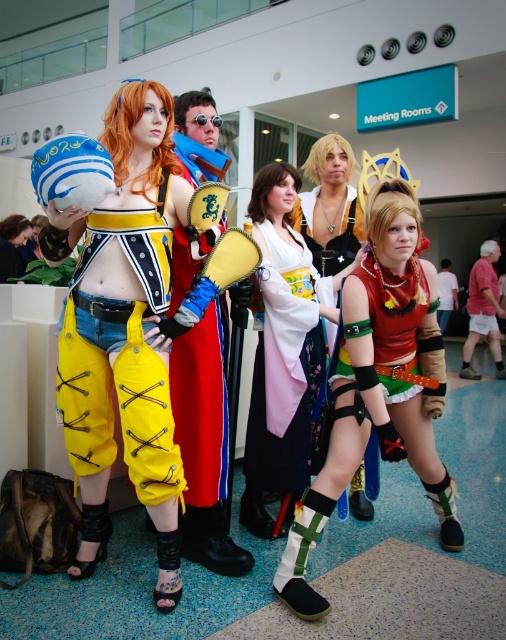
Does matte yellow pants at center appear on the left side of matte red and green boots at center?

Yes, matte yellow pants at center is to the left of matte red and green boots at center.

Does matte yellow pants at center have a greater height compared to matte red and green boots at center?

Indeed, matte yellow pants at center has a greater height compared to matte red and green boots at center.

The width and height of the screenshot is (506, 640). Identify the location of matte yellow pants at center. pyautogui.click(x=123, y=328).

Locate an element on the screen. matte yellow pants at center is located at coordinates (123, 328).

Who is higher up, matte red and green boots at center or yellow leather pants at center?

yellow leather pants at center is above.

Can you confirm if matte red and green boots at center is shorter than yellow leather pants at center?

Indeed, matte red and green boots at center has a lesser height compared to yellow leather pants at center.

Identify the location of matte red and green boots at center. (380, 384).

Which is in front, point (134, 355) or point (265, 365)?

Point (134, 355) is more forward.

From the picture: Who is taller, yellow fabric pants at center or white silk kimono at center?

Standing taller between the two is white silk kimono at center.

Between point (160, 259) and point (306, 465), which one is positioned in front?

Positioned in front is point (160, 259).

Identify the location of yellow fabric pants at center. This screenshot has height=640, width=506. (119, 358).